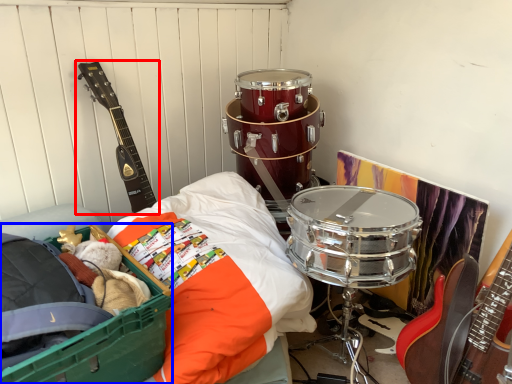
Question: Which object appears closest to the camera in this image, guitar (highlighted by a red box) or storage box (highlighted by a blue box)?

Choices:
 (A) guitar
 (B) storage box

Answer: (B)